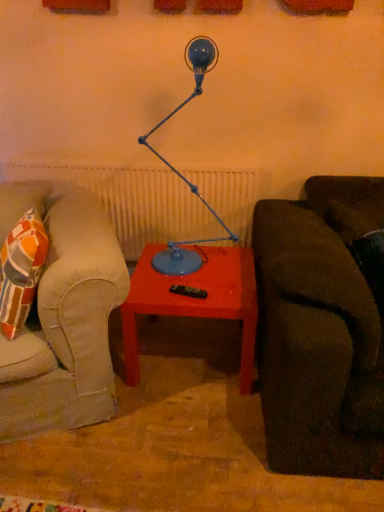
Question: Is the depth of matte red table at center greater than that of blue matte table lamp at center?

Choices:
 (A) no
 (B) yes

Answer: (B)

Question: From a real-world perspective, is matte red table at center physically above blue matte table lamp at center?

Choices:
 (A) no
 (B) yes

Answer: (A)

Question: Is matte red table at center not inside blue matte table lamp at center?

Choices:
 (A) yes
 (B) no

Answer: (A)

Question: Is matte red table at center to the right of blue matte table lamp at center from the viewer's perspective?

Choices:
 (A) yes
 (B) no

Answer: (A)

Question: Is matte red table at center positioned with its back to blue matte table lamp at center?

Choices:
 (A) yes
 (B) no

Answer: (B)

Question: From a real-world perspective, is matte red table at center physically below blue matte table lamp at center?

Choices:
 (A) yes
 (B) no

Answer: (A)

Question: Does blue matte table lamp at center have a smaller size compared to matte red table at center?

Choices:
 (A) yes
 (B) no

Answer: (A)

Question: From a real-world perspective, is blue matte table lamp at center positioned under matte red table at center based on gravity?

Choices:
 (A) no
 (B) yes

Answer: (A)

Question: Does blue matte table lamp at center have a greater width compared to matte red table at center?

Choices:
 (A) no
 (B) yes

Answer: (A)

Question: Is blue matte table lamp at center facing away from matte red table at center?

Choices:
 (A) no
 (B) yes

Answer: (A)

Question: Can you confirm if blue matte table lamp at center is positioned to the right of matte red table at center?

Choices:
 (A) no
 (B) yes

Answer: (A)

Question: From the image's perspective, is blue matte table lamp at center located above matte red table at center?

Choices:
 (A) yes
 (B) no

Answer: (A)

Question: In the image, is blue matte table lamp at center positioned in front of or behind matte red table at center?

Choices:
 (A) behind
 (B) front

Answer: (B)